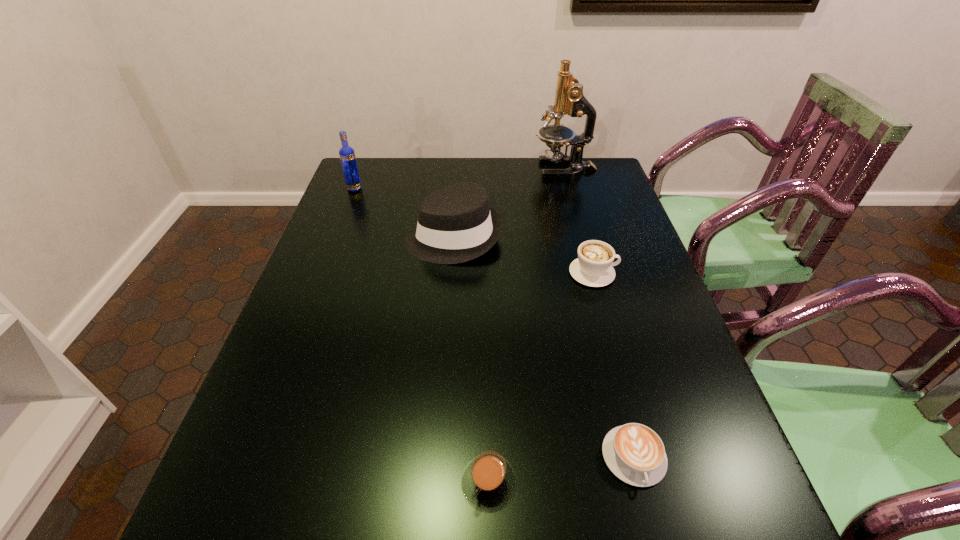
Identify the location of microscope. (569, 98).

The width and height of the screenshot is (960, 540). Identify the location of the tallest object. (569, 98).

Where is `the fifth nearest object`? This screenshot has height=540, width=960. the fifth nearest object is located at coordinates (x=347, y=155).

The image size is (960, 540). What are the coordinates of `the fifth shortest object` in the screenshot? It's located at (347, 155).

Identify the location of fedora. The width and height of the screenshot is (960, 540). (455, 224).

You are a GUI agent. You are given a task and a screenshot of the screen. Output one action in this format:
    pyautogui.click(x=<x>, y=<y>)
    Task: Click on the farthest cappuccino
    
    Given the screenshot: What is the action you would take?
    pyautogui.click(x=593, y=267)

Locate an element on the screen. The height and width of the screenshot is (540, 960). the fourth tallest object is located at coordinates (593, 267).

This screenshot has width=960, height=540. What are the coordinates of `the leftmost cappuccino` in the screenshot? It's located at (488, 481).

The width and height of the screenshot is (960, 540). I want to click on the second shortest object, so click(488, 481).

The width and height of the screenshot is (960, 540). Find the location of `the shortest cappuccino`. the shortest cappuccino is located at coordinates (634, 453).